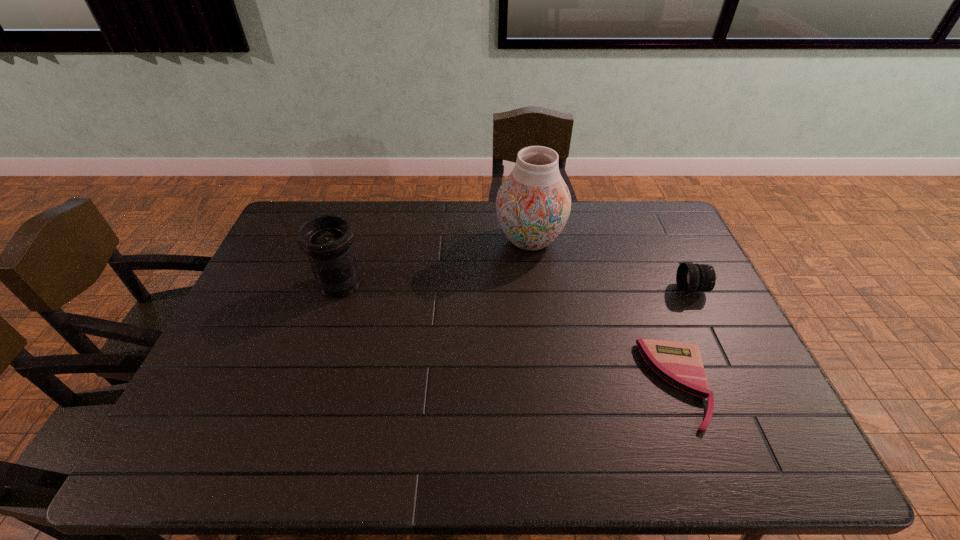
The width and height of the screenshot is (960, 540). Find the location of `the second object from left to right`. the second object from left to right is located at coordinates (533, 204).

Locate an element on the screen. This screenshot has width=960, height=540. the tallest object is located at coordinates (533, 204).

At what (x,y) coordinates should I click in order to perform the action: click on the left telephoto lens. Please return your answer as a coordinate pair (x, y). Looking at the image, I should click on (327, 239).

I want to click on the taller telephoto lens, so click(x=327, y=239).

The height and width of the screenshot is (540, 960). Find the location of `the rightmost object`. the rightmost object is located at coordinates (690, 278).

The image size is (960, 540). I want to click on the shorter telephoto lens, so click(x=690, y=278).

This screenshot has width=960, height=540. In order to click on wristlet in this screenshot , I will do `click(680, 364)`.

Find the location of `the third object from left to right`. the third object from left to right is located at coordinates (680, 364).

Locate an element on the screen. vacant space located 0.360m on the front of the vase is located at coordinates (544, 354).

This screenshot has width=960, height=540. In order to click on blank space located 0.320m on the front of the left telephoto lens in this screenshot , I will do [304, 397].